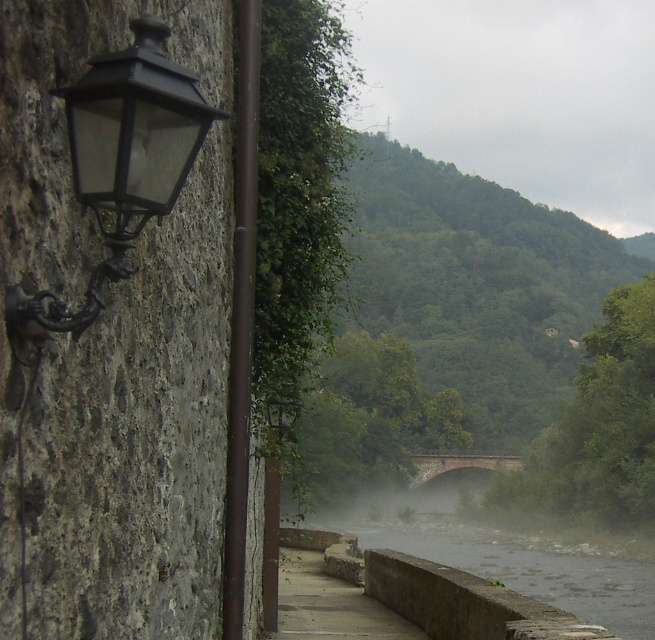
Which is behind, point (132, 97) or point (455, 467)?

Point (455, 467)

Describe the element at coordinates (121, 163) in the screenshot. I see `matte black lantern at left` at that location.

At what (x,y) coordinates should I click in order to perform the action: click on matte black lantern at left. Please return your answer as a coordinate pair (x, y). The width and height of the screenshot is (655, 640). Looking at the image, I should click on (121, 163).